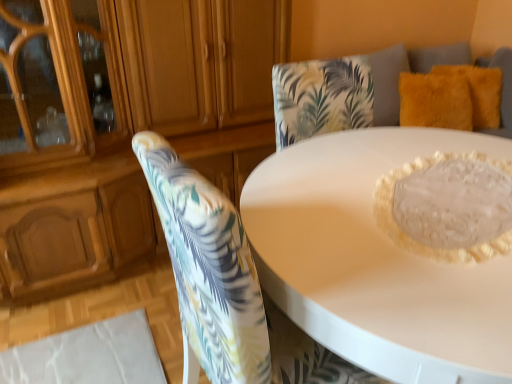
Question: Does fuzzy yellow pillow at upper right, positioned as the first pillow in right-to-left order, have a greater width compared to white glossy table at center?

Choices:
 (A) no
 (B) yes

Answer: (A)

Question: Is the depth of fuzzy yellow pillow at upper right, positioned as the first pillow in right-to-left order, greater than that of white glossy table at center?

Choices:
 (A) yes
 (B) no

Answer: (A)

Question: Is fuzzy yellow pillow at upper right, positioned as the first pillow in right-to-left order, to the right of white glossy table at center from the viewer's perspective?

Choices:
 (A) no
 (B) yes

Answer: (B)

Question: Is fuzzy yellow pillow at upper right, which is the second pillow from left to right, not near white glossy table at center?

Choices:
 (A) no
 (B) yes

Answer: (B)

Question: Does fuzzy yellow pillow at upper right, which is the second pillow from left to right, have a smaller size compared to white glossy table at center?

Choices:
 (A) no
 (B) yes

Answer: (B)

Question: Considering the positions of matte wood dresser at upper left and floral fabric chair at center in the image, is matte wood dresser at upper left taller or shorter than floral fabric chair at center?

Choices:
 (A) short
 (B) tall

Answer: (B)

Question: Considering the positions of matte wood dresser at upper left and floral fabric chair at center in the image, is matte wood dresser at upper left wider or thinner than floral fabric chair at center?

Choices:
 (A) thin
 (B) wide

Answer: (B)

Question: Is matte wood dresser at upper left inside or outside of floral fabric chair at center?

Choices:
 (A) outside
 (B) inside

Answer: (A)

Question: Considering their positions, is matte wood dresser at upper left located in front of or behind floral fabric chair at center?

Choices:
 (A) front
 (B) behind

Answer: (B)

Question: Looking at the image, does floral fabric chair at center seem bigger or smaller compared to white glossy table at center?

Choices:
 (A) small
 (B) big

Answer: (A)

Question: Is point (179, 249) positioned closer to the camera than point (391, 269)?

Choices:
 (A) farther
 (B) closer

Answer: (B)

Question: Is floral fabric chair at center spatially inside white glossy table at center, or outside of it?

Choices:
 (A) inside
 (B) outside

Answer: (A)

Question: Looking at their shapes, would you say floral fabric chair at center is wider or thinner than white glossy table at center?

Choices:
 (A) thin
 (B) wide

Answer: (A)

Question: Is translucent glass cake at center to the left or to the right of matte wood dresser at upper left in the image?

Choices:
 (A) left
 (B) right

Answer: (B)

Question: Considering the positions of translucent glass cake at center and matte wood dresser at upper left in the image, is translucent glass cake at center bigger or smaller than matte wood dresser at upper left?

Choices:
 (A) small
 (B) big

Answer: (A)